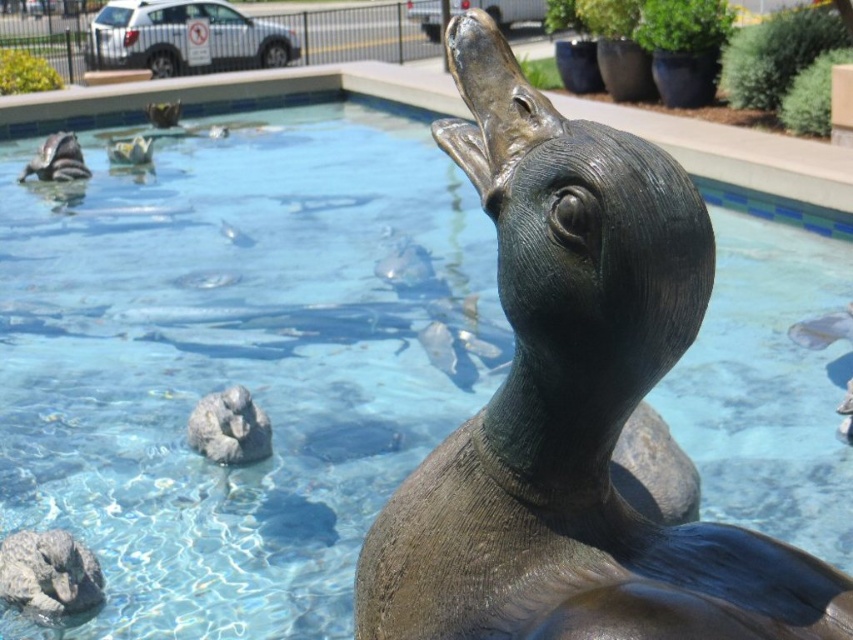
Is gray stone rock at lower left below matte black seal at upper left?

Indeed, gray stone rock at lower left is positioned under matte black seal at upper left.

Does gray stone rock at lower left appear on the right side of matte black seal at upper left?

Correct, you'll find gray stone rock at lower left to the right of matte black seal at upper left.

Describe the element at coordinates (49, 573) in the screenshot. I see `gray stone rock at lower left` at that location.

This screenshot has width=853, height=640. Identify the location of gray stone rock at lower left. (49, 573).

Who is more forward, (260, 452) or (44, 154)?

Point (260, 452)

Which is in front, point (253, 442) or point (28, 170)?

Positioned in front is point (253, 442).

You are a GUI agent. You are given a task and a screenshot of the screen. Output one action in this format:
    pyautogui.click(x=<x>, y=<y>)
    Task: Click on the gray stone rock at center
    This screenshot has height=640, width=853.
    Given the screenshot: What is the action you would take?
    pyautogui.click(x=229, y=428)

Who is taller, gray stone rock at lower left or gray stone rock at center?

gray stone rock at center

Can you confirm if gray stone rock at lower left is shorter than gray stone rock at center?

Indeed, gray stone rock at lower left has a lesser height compared to gray stone rock at center.

At what (x,y) coordinates should I click in order to perform the action: click on gray stone rock at lower left. Please return your answer as a coordinate pair (x, y). The height and width of the screenshot is (640, 853). Looking at the image, I should click on (49, 573).

You are a GUI agent. You are given a task and a screenshot of the screen. Output one action in this format:
    pyautogui.click(x=<x>, y=<y>)
    Task: Click on the gray stone rock at lower left
    The width and height of the screenshot is (853, 640).
    Given the screenshot: What is the action you would take?
    pyautogui.click(x=49, y=573)